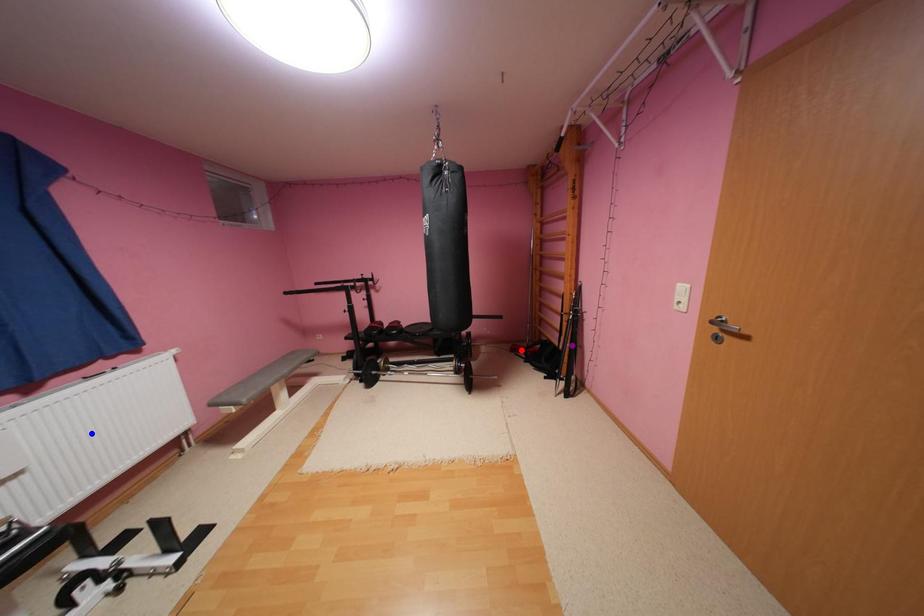
Order these from nearest to farthest:
purple point, red point, blue point

blue point → purple point → red point